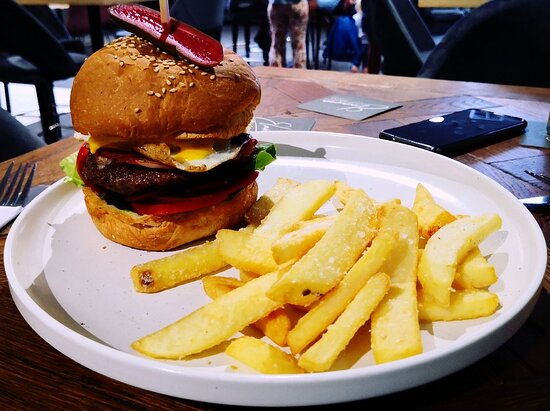
In order to click on fork in this screenshot , I will do `click(8, 210)`.